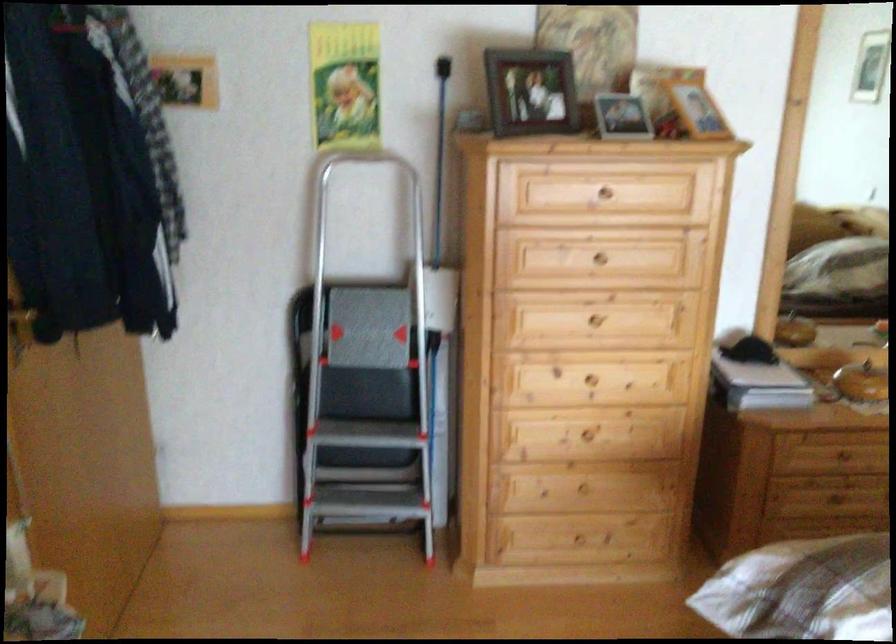
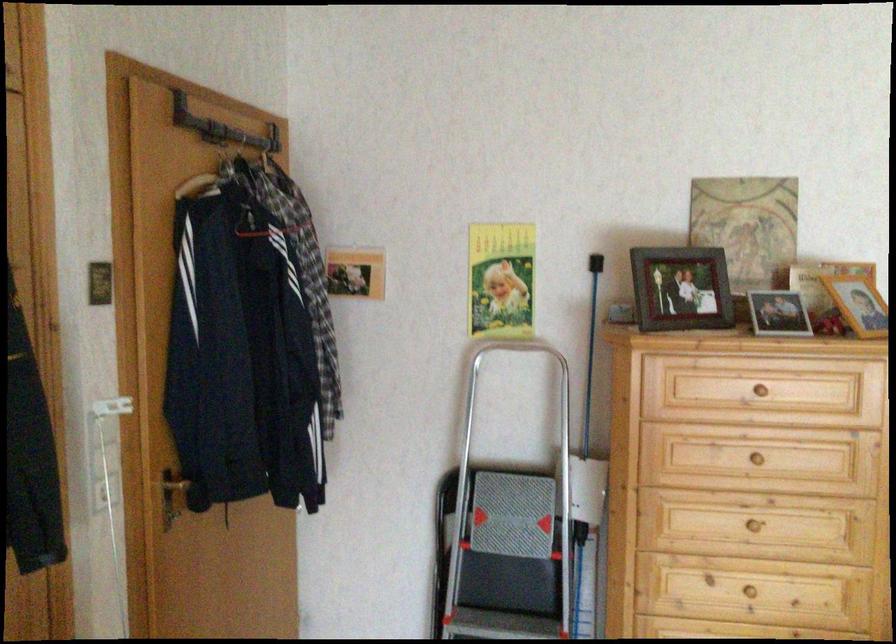
In the second image, find the point that corresponds to (593,257) in the first image.

(754, 456)